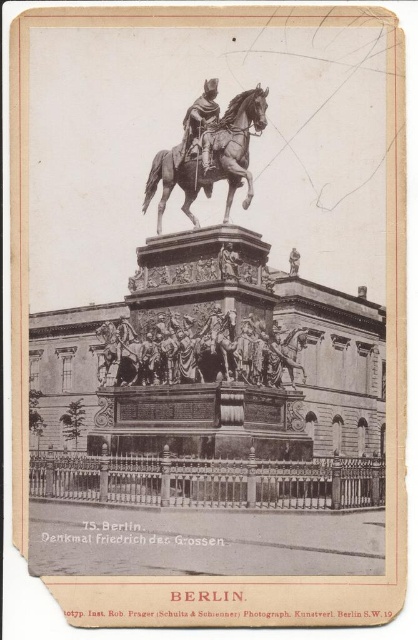
You are an art conservator assessing the statue. You need to determine which object has a greater width between the polished bronze horse at center and the bronze statue at center. Which one is wider?

The polished bronze horse at center might be wider than bronze statue at center.

You are an art student analyzing the statue. You notice the polished bronze horse at center and the bronze statue at center. Which one is shorter in height?

The polished bronze horse at center is not as tall as the bronze statue at center, so the polished bronze horse at center is shorter.